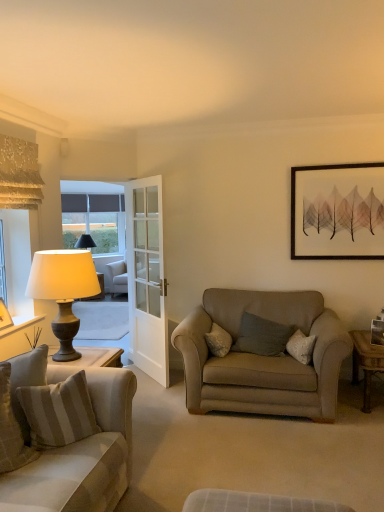
What do you see at coordinates (11, 429) in the screenshot? I see `striped fabric pillow at lower left, acting as the 1th pillow starting from the left` at bounding box center [11, 429].

Identify the location of soft gray cushion at center, the 3th pillow when ordered from front to back. (262, 336).

Image resolution: width=384 pixels, height=512 pixels. What do you see at coordinates (63, 435) in the screenshot?
I see `beige fabric couch at left` at bounding box center [63, 435].

What do you see at coordinates (94, 214) in the screenshot? Image resolution: width=384 pixels, height=512 pixels. I see `matte glass window at left` at bounding box center [94, 214].

Identify the location of striped fabric pillow at lower left, acting as the 3th pillow starting from the back. (11, 429).

From the image's perspective, which pillow is the 2nd one below the wooden picture frame at right, placed as the 1th picture frame when sorted from right to left? Please provide its 2D coordinates.

[(11, 429)]

Does wooden picture frame at right, the 3th picture frame from the left, touch striped fabric pillow at lower left, acting as the 3th pillow starting from the back?

wooden picture frame at right, the 3th picture frame from the left, and striped fabric pillow at lower left, acting as the 3th pillow starting from the back, are clearly separated.

Is striped fabric pillow at lower left, acting as the 1th pillow starting from the left, at the back of wooden picture frame at right, which is counted as the third picture frame, starting from the top?

That's not correct — wooden picture frame at right, which is counted as the third picture frame, starting from the top, is not looking away from striped fabric pillow at lower left, acting as the 1th pillow starting from the left.

Is wooden picture frame at right, which ranks as the 1th picture frame in bottom-to-top order, located outside soft gray cushion at center, the first pillow viewed from the right?

That's correct, wooden picture frame at right, which ranks as the 1th picture frame in bottom-to-top order, is outside of soft gray cushion at center, the first pillow viewed from the right.

Does point (380, 343) appear closer or farther from the camera than point (256, 337)?

Point (380, 343).

Who is more distant, wooden picture frame at right, which ranks as the 1th picture frame in bottom-to-top order, or soft gray cushion at center, the 3th pillow positioned from the left?

wooden picture frame at right, which ranks as the 1th picture frame in bottom-to-top order.

Consider the image. Based on their positions, is wooden picture frame at right, which appears as the second picture frame when viewed from the back, located to the left or right of soft gray cushion at center, the 3th pillow when ordered from front to back?

From the image, it's evident that wooden picture frame at right, which appears as the second picture frame when viewed from the back, is to the right of soft gray cushion at center, the 3th pillow when ordered from front to back.

Which object is positioned more to the left, striped fabric pillow at lower left, acting as the 1th pillow starting from the left, or matte gray lamp at left?

From the viewer's perspective, striped fabric pillow at lower left, acting as the 1th pillow starting from the left, appears more on the left side.

Can you confirm if striped fabric pillow at lower left, marked as the 3th pillow in a right-to-left arrangement, is taller than matte gray lamp at left?

Incorrect, the height of striped fabric pillow at lower left, marked as the 3th pillow in a right-to-left arrangement, is not larger of that of matte gray lamp at left.

From the picture: Which is correct: striped fabric pillow at lower left, acting as the 1th pillow starting from the left, is inside matte gray lamp at left, or outside of it?

striped fabric pillow at lower left, acting as the 1th pillow starting from the left, is not enclosed by matte gray lamp at left.

Are striped fabric pillow at lower left, acting as the 3th pillow starting from the back, and matte glass window at left far apart?

Yes, striped fabric pillow at lower left, acting as the 3th pillow starting from the back, is far from matte glass window at left.

Does striped fabric pillow at lower left, the first pillow viewed from the front, have a lesser height compared to matte glass window at left?

Correct, striped fabric pillow at lower left, the first pillow viewed from the front, is not as tall as matte glass window at left.

Between striped fabric pillow at lower left, the first pillow viewed from the front, and matte glass window at left, which one has larger width?

With larger width is striped fabric pillow at lower left, the first pillow viewed from the front.

Is striped fabric pillow at lower left, acting as the 1th pillow starting from the left, looking in the opposite direction of matte glass window at left?

striped fabric pillow at lower left, acting as the 1th pillow starting from the left, is not turned away from matte glass window at left.

Can you confirm if matte black picture frame at upper right, positioned as the second picture frame in right-to-left order, is bigger than matte glass window at left?

Actually, matte black picture frame at upper right, positioned as the second picture frame in right-to-left order, might be smaller than matte glass window at left.

Is matte black picture frame at upper right, positioned as the second picture frame in right-to-left order, aimed at matte glass window at left?

No.

There is a matte glass window at left. Find the location of `the 1st picture frame below it (from the image's perspective)`. the 1st picture frame below it (from the image's perspective) is located at coordinates (337, 211).

Which of these two, beige fabric couch at left or matte glass window at left, is thinner?

matte glass window at left is thinner.

Which object is further away from the camera, beige fabric couch at left or matte glass window at left?

Positioned behind is matte glass window at left.

From a real-world perspective, is beige fabric couch at left positioned above or below matte glass window at left?

beige fabric couch at left is situated lower than matte glass window at left in the real world.

Can you confirm if beige fabric couch at left is positioned to the left of matte glass window at left?

No.

Is wooden desk at right closer to the viewer compared to wooden picture frame at left, which is the first picture frame in front-to-back order?

No, the depth of wooden desk at right is greater than that of wooden picture frame at left, which is the first picture frame in front-to-back order.

Who is shorter, wooden desk at right or wooden picture frame at left, positioned as the second picture frame in bottom-to-top order?

With less height is wooden picture frame at left, positioned as the second picture frame in bottom-to-top order.

In the scene shown: Is wooden picture frame at left, the 2th picture frame viewed from the top, inside wooden desk at right?

No, wooden picture frame at left, the 2th picture frame viewed from the top, is not a part of wooden desk at right.

Does wooden desk at right appear on the left side of wooden picture frame at left, positioned as the second picture frame in bottom-to-top order?

No, wooden desk at right is not to the left of wooden picture frame at left, positioned as the second picture frame in bottom-to-top order.

At what (x,y) coordinates should I click in order to perform the action: click on picture frame below the striped fabric pillow at lower left, acting as the 3th pillow starting from the back (from a real-world perspective). Please return your answer as a coordinate pair (x, y). Looking at the image, I should click on (377, 332).

Starting from the wooden picture frame at right, placed as the 1th picture frame when sorted from right to left, which pillow is the 1st one in front? Please provide its 2D coordinates.

[(262, 336)]

When comparing their distances from wooden picture frame at left, positioned as the second picture frame in bottom-to-top order, does soft gray cushion at center, the 3th pillow when ordered from front to back, or matte black picture frame at upper right, placed as the first picture frame when sorted from back to front, seem closer?

Among the two, soft gray cushion at center, the 3th pillow when ordered from front to back, is located nearer to wooden picture frame at left, positioned as the second picture frame in bottom-to-top order.

Consider the image. Looking at the image, which one is located closer to matte gray lamp at left, wooden picture frame at left, which appears as the 3th picture frame when viewed from the right, or wooden desk at right?

wooden picture frame at left, which appears as the 3th picture frame when viewed from the right.

From the image, which object appears to be farther from wooden picture frame at left, the first picture frame in the left-to-right sequence, matte black picture frame at upper right, positioned as the 3th picture frame in front-to-back order, or beige fabric couch at left?

Among the two, matte black picture frame at upper right, positioned as the 3th picture frame in front-to-back order, is located further to wooden picture frame at left, the first picture frame in the left-to-right sequence.

Consider the image. From the image, which object appears to be farther from wooden picture frame at left, the 2th picture frame viewed from the top, matte black picture frame at upper right, positioned as the second picture frame in right-to-left order, or wooden picture frame at right, positioned as the 2th picture frame in front-to-back order?

wooden picture frame at right, positioned as the 2th picture frame in front-to-back order, is positioned further to the anchor wooden picture frame at left, the 2th picture frame viewed from the top.

Considering their positions, is beige fabric couch at left positioned further to soft gray cushion at center, marked as the 1th pillow in a back-to-front arrangement, than matte gray lamp at left?

Among the two, beige fabric couch at left is located further to soft gray cushion at center, marked as the 1th pillow in a back-to-front arrangement.

Based on their spatial positions, is wooden picture frame at right, which ranks as the 1th picture frame in bottom-to-top order, or matte black picture frame at upper right, positioned as the 3th picture frame in front-to-back order, further from striped fabric pillow at lower left, marked as the 3th pillow in a right-to-left arrangement?

matte black picture frame at upper right, positioned as the 3th picture frame in front-to-back order, lies further to striped fabric pillow at lower left, marked as the 3th pillow in a right-to-left arrangement, than the other object.

When comparing their distances from matte glass window at left, does soft gray cushion at center, the 3th pillow when ordered from front to back, or matte gray lamp at left seem further?

The object further to matte glass window at left is soft gray cushion at center, the 3th pillow when ordered from front to back.

When comparing their distances from wooden desk at right, does beige striped cushion at lower left, the 2th pillow when ordered from back to front, or matte gray lamp at left seem further?

beige striped cushion at lower left, the 2th pillow when ordered from back to front.

At what (x,y) coordinates should I click in order to perform the action: click on studio couch between wooden picture frame at left, which appears as the 3th picture frame when viewed from the right, and wooden desk at right from left to right. Please return your answer as a coordinate pair (x, y). Looking at the image, I should click on (63, 435).

The image size is (384, 512). I want to click on lamp situated between wooden picture frame at left, the 3th picture frame viewed from the back, and matte black picture frame at upper right, acting as the first picture frame starting from the top, from left to right, so click(63, 291).

Locate an element on the screen. The image size is (384, 512). desk between beige fabric couch at left and wooden picture frame at right, which is counted as the third picture frame, starting from the top, from left to right is located at coordinates (366, 362).

The height and width of the screenshot is (512, 384). I want to click on pillow positioned between striped fabric pillow at lower left, acting as the 3th pillow starting from the back, and soft gray cushion at center, the first pillow viewed from the right, from near to far, so click(x=58, y=412).